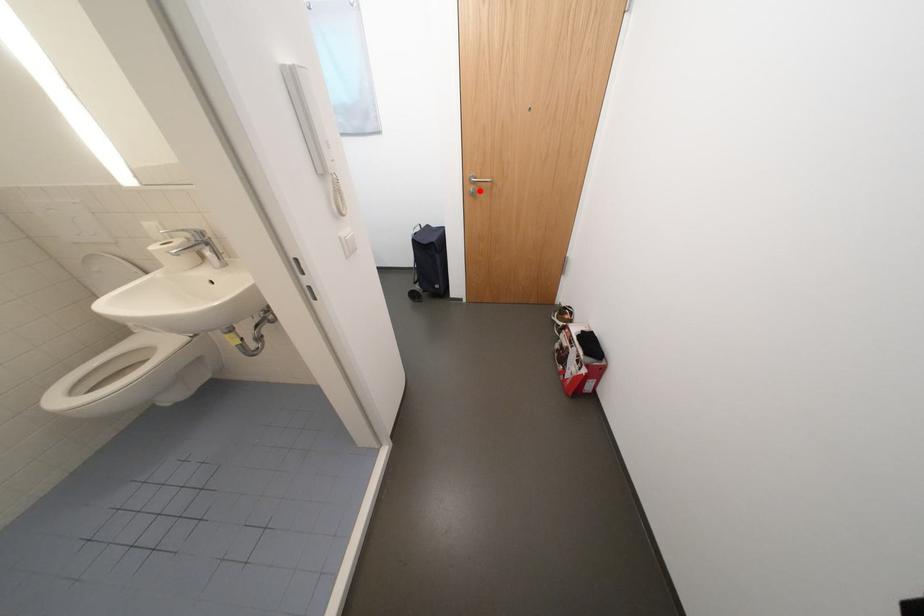
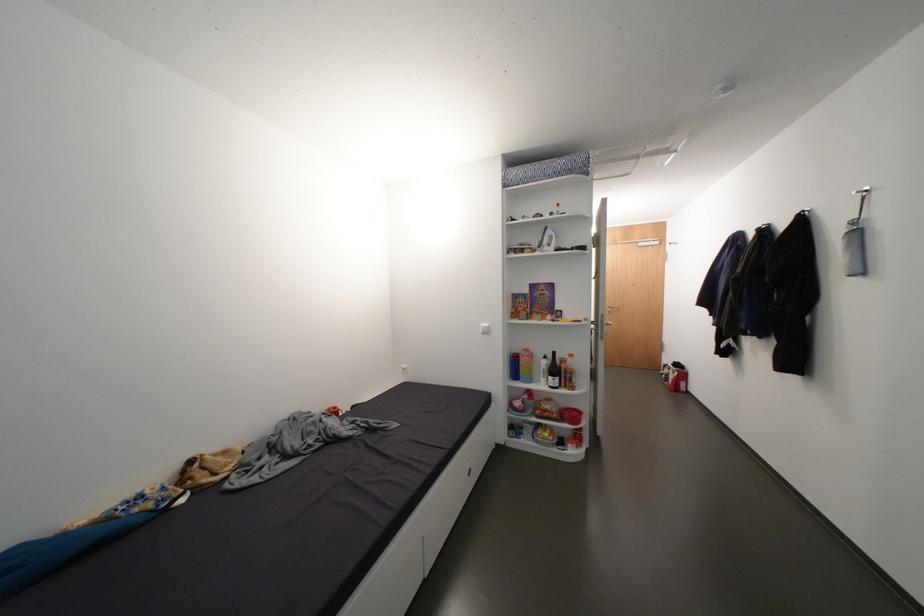
Question: I am providing you with two images of the same scene from different viewpoints. In image1, a red point is highlighted. Considering the same 3D point in image2, which of the following is correct?

Choices:
 (A) It is closer
 (B) It is farther

Answer: (B)